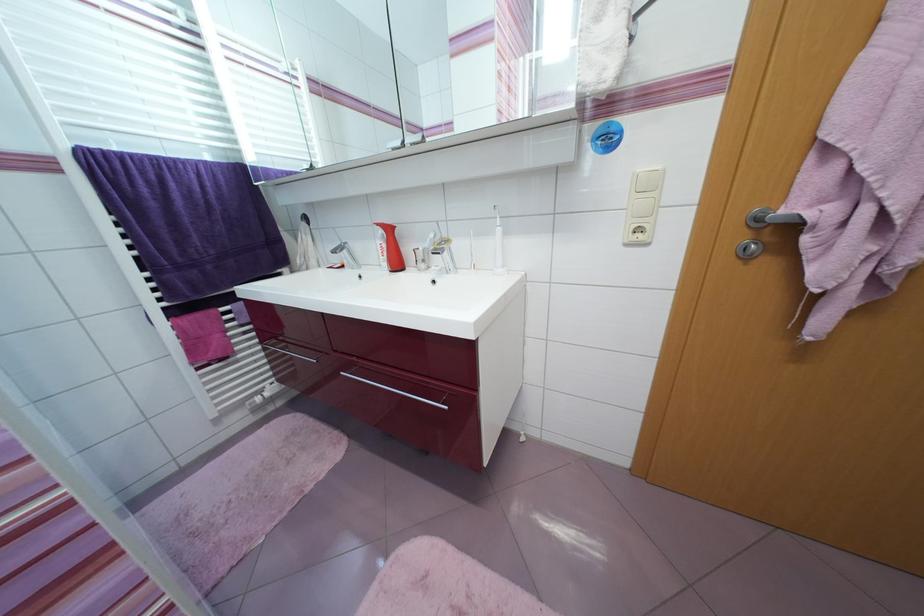
Identify the location of white electric toothbrush. (497, 245).